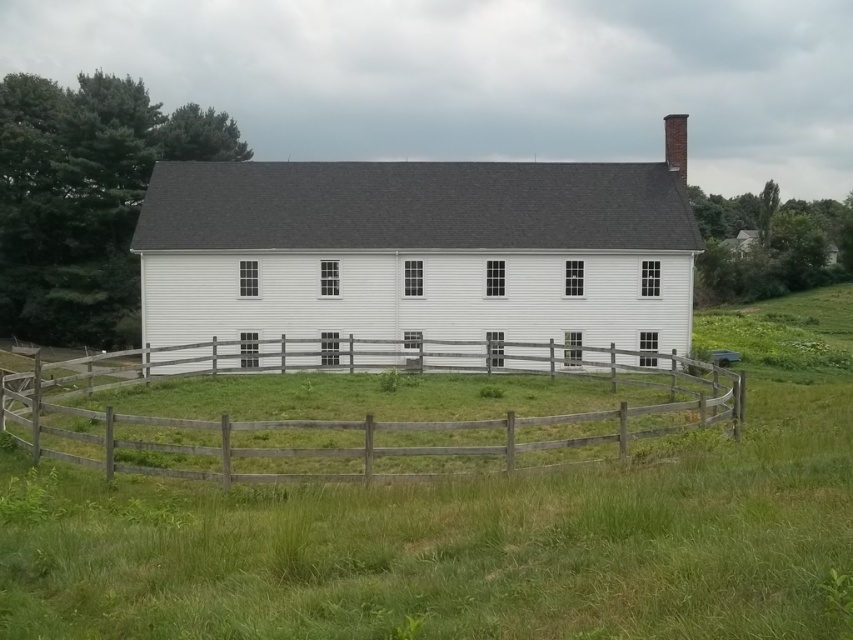
Is the position of white wooden barn at center more distant than that of gray brick chimney at upper right?

No.

Which is in front, point (339, 220) or point (668, 122)?

Positioned in front is point (339, 220).

What do you see at coordinates (416, 252) in the screenshot?
I see `white wooden barn at center` at bounding box center [416, 252].

Find the location of a particular element. The image size is (853, 640). white wooden barn at center is located at coordinates (416, 252).

Which is above, wooden fence at center or gray brick chimney at upper right?

gray brick chimney at upper right is higher up.

Between wooden fence at center and gray brick chimney at upper right, which one appears on the right side from the viewer's perspective?

Positioned to the right is gray brick chimney at upper right.

What do you see at coordinates (334, 419) in the screenshot? This screenshot has height=640, width=853. I see `wooden fence at center` at bounding box center [334, 419].

Find the location of a particular element. wooden fence at center is located at coordinates (334, 419).

Looking at this image, does white wooden barn at center lie in front of wooden fence at center?

No, it is behind wooden fence at center.

Is white wooden barn at center bigger than wooden fence at center?

Indeed, white wooden barn at center has a larger size compared to wooden fence at center.

Locate an element on the screen. This screenshot has width=853, height=640. white wooden barn at center is located at coordinates (416, 252).